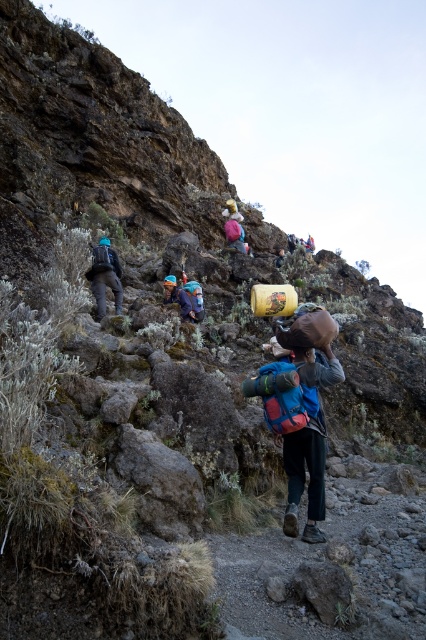
Who is positioned more to the left, matte black backpack at left or matte pink backpack at center?

matte black backpack at left

Does matte black backpack at left appear over matte pink backpack at center?

Actually, matte black backpack at left is below matte pink backpack at center.

The image size is (426, 640). What are the coordinates of `matte black backpack at left` in the screenshot? It's located at (104, 276).

This screenshot has height=640, width=426. In order to click on matte black backpack at left in this screenshot , I will do `click(104, 276)`.

Is matte black backpack at left positioned at the back of brushed metal backpack at center?

No, it is in front of brushed metal backpack at center.

Can you confirm if matte black backpack at left is smaller than brushed metal backpack at center?

Incorrect, matte black backpack at left is not smaller in size than brushed metal backpack at center.

Between point (118, 294) and point (189, 296), which one is positioned behind?

The point (189, 296) is more distant.

Locate an element on the screen. matte black backpack at left is located at coordinates (104, 276).

Where is `matte pink backpack at center`? The height and width of the screenshot is (640, 426). matte pink backpack at center is located at coordinates (235, 230).

Is matte pink backpack at center taller than brushed metal backpack at center?

In fact, matte pink backpack at center may be shorter than brushed metal backpack at center.

Find the location of a particular element. matte pink backpack at center is located at coordinates (235, 230).